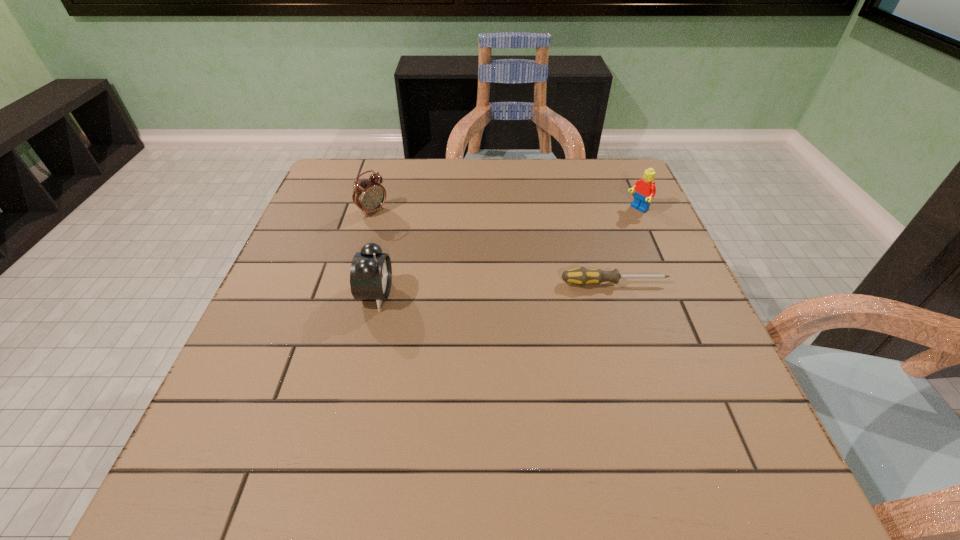
The width and height of the screenshot is (960, 540). What are the coordinates of `vacant area at the right edge of the desktop` in the screenshot? It's located at [x=658, y=323].

This screenshot has width=960, height=540. In order to click on free region at the near left corner of the desktop in this screenshot , I will do `click(231, 416)`.

Find the location of a particular element. Image resolution: width=960 pixels, height=540 pixels. free spot between the shortest object and the farther alarm clock is located at coordinates (493, 247).

The image size is (960, 540). What are the coordinates of `blank region between the Lego and the farther alarm clock` in the screenshot? It's located at (505, 210).

Find the location of a particular element. This screenshot has height=540, width=960. free space between the Lego and the screwdriver is located at coordinates (626, 246).

Locate an element on the screen. Image resolution: width=960 pixels, height=540 pixels. vacant space that is in between the nearer alarm clock and the shortest object is located at coordinates (495, 289).

This screenshot has height=540, width=960. In order to click on free area in between the nearer alarm clock and the screwdriver in this screenshot , I will do `click(495, 289)`.

Find the location of a particular element. This screenshot has width=960, height=540. free space that is in between the nearer alarm clock and the shortest object is located at coordinates (495, 289).

What are the coordinates of `vacant space in between the shortest object and the farther alarm clock` in the screenshot? It's located at (493, 247).

Where is `free point between the farther alarm clock and the Lego`? This screenshot has width=960, height=540. free point between the farther alarm clock and the Lego is located at coordinates (505, 210).